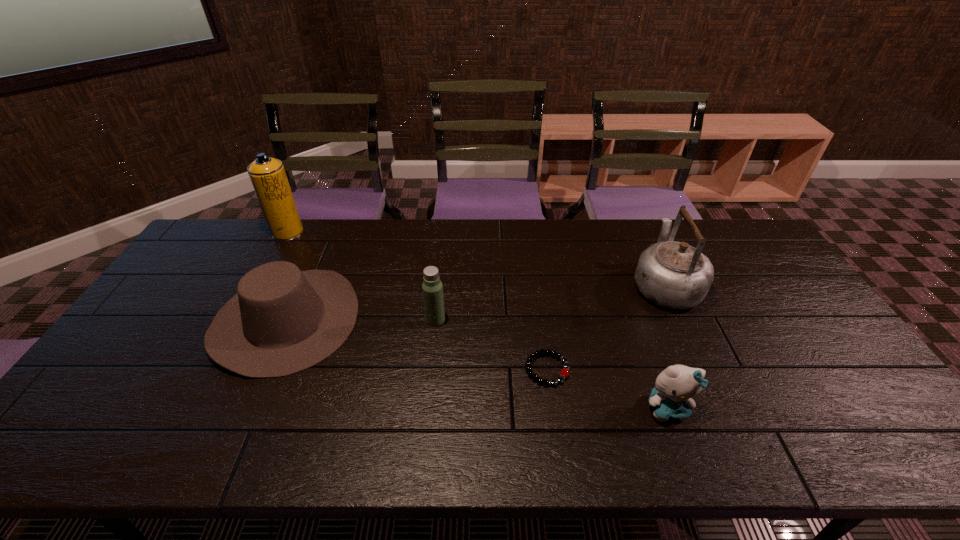
This screenshot has width=960, height=540. In order to click on free spot between the kettle and the aerosol can in this screenshot , I will do `click(476, 258)`.

You are a GUI agent. You are given a task and a screenshot of the screen. Output one action in this format:
    pyautogui.click(x=<x>, y=<y>)
    Task: Click on the vacant area that lies between the third object from right to left and the nearest object
    This screenshot has width=960, height=540.
    Given the screenshot: What is the action you would take?
    pyautogui.click(x=607, y=388)

In order to click on free area in between the aerosol can and the fifth shortest object in this screenshot , I will do `click(476, 258)`.

Find the location of `vacant space in between the tallest object and the fourth shortest object`. vacant space in between the tallest object and the fourth shortest object is located at coordinates (362, 276).

Identify the location of empty location between the cowboy hat and the kitten. (476, 363).

Locate which object is the second closest to the nearest object. Please provide its 2D coordinates. Your answer should be formatted as a tuple, i.e. [(x, y)], where the tuple contains the x and y coordinates of a point satisfying the conditions above.

[(675, 275)]

Locate which object is the fourth closest to the nearest object. Please provide its 2D coordinates. Your answer should be formatted as a tuple, i.e. [(x, y)], where the tuple contains the x and y coordinates of a point satisfying the conditions above.

[(282, 321)]

This screenshot has height=540, width=960. I want to click on vacant space that satisfies the following two spatial constraints: 1. on the front side of the cowboy hat; 2. on the left side of the tallest object, so click(x=241, y=319).